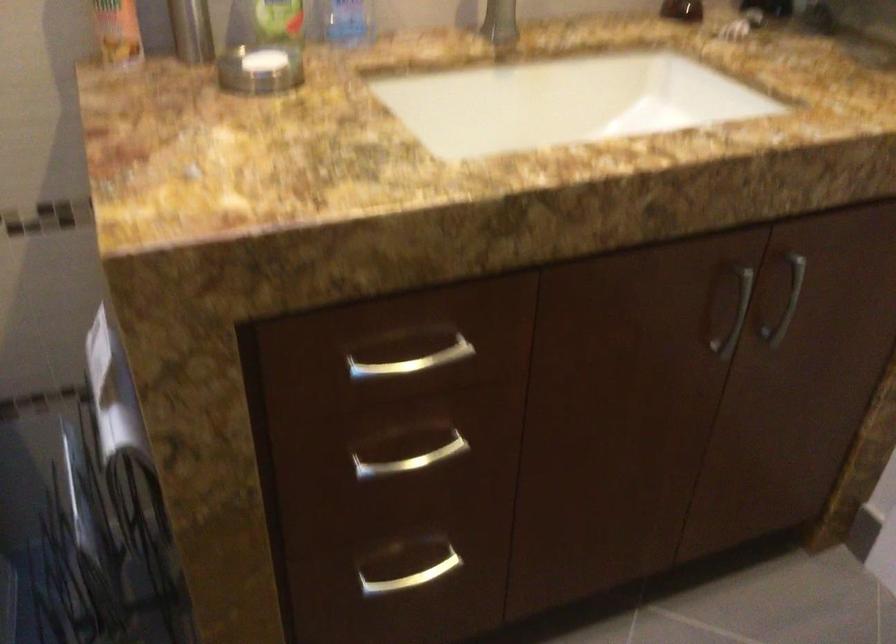
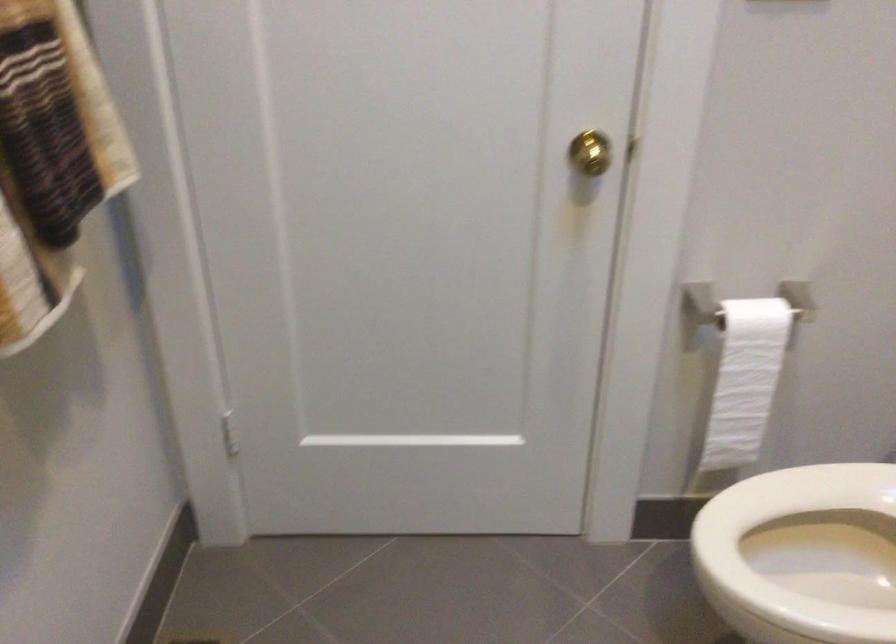
The images are taken continuously from a first-person perspective. In which direction is your viewpoint rotating?

The rotation direction of the camera is left-down.